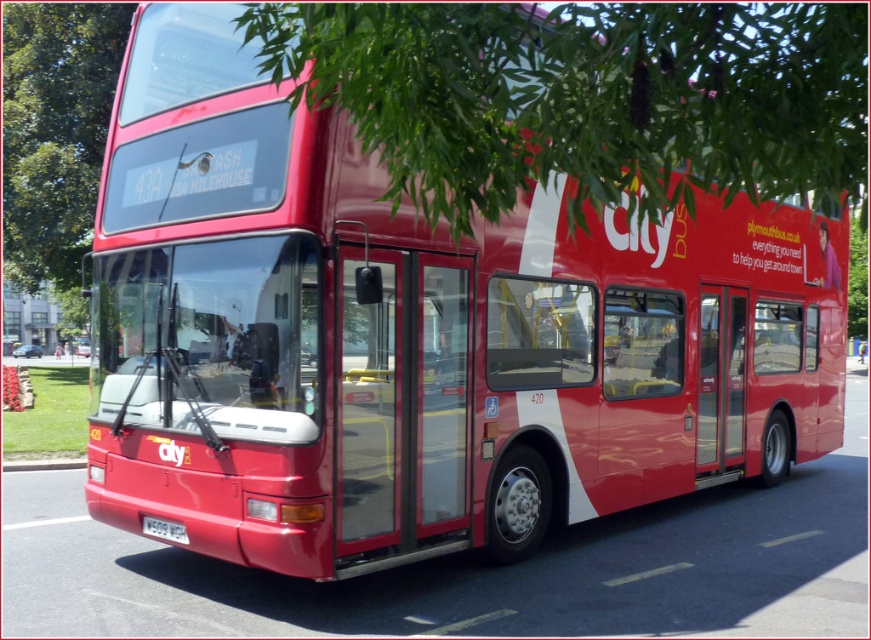
You are a delivery drone operator. Your drone needs to fly from the green leafy tree at upper center to the red double decker bus. What direction should you fly to reach the bus?

The green leafy tree at upper center is located at point (584, 99). To reach the red double decker bus, you should fly downward and to the right since the bus is positioned lower and to the right of the tree.

In the scene shown: You are a pedestrian standing at the sidewalk in front of the red double decker bus. You want to look at the white plastic license plate at lower center and then glance at the green leafy tree at upper center. In which direction should you move your head?

You should move your head to the right because the green leafy tree at upper center is to the right of the white plastic license plate at lower center.

You are a delivery person standing next to the white plastic license plate at lower center. You need to place a package under the green leafy tree at upper center. Can you reach the tree without moving the bus?

The distance between the green leafy tree at upper center and the white plastic license plate at lower center is 3.37 meters. Since you are standing next to the license plate, you can easily reach the tree by walking around the bus, as the distance is manageable for a person to cover without needing to move the entire bus.